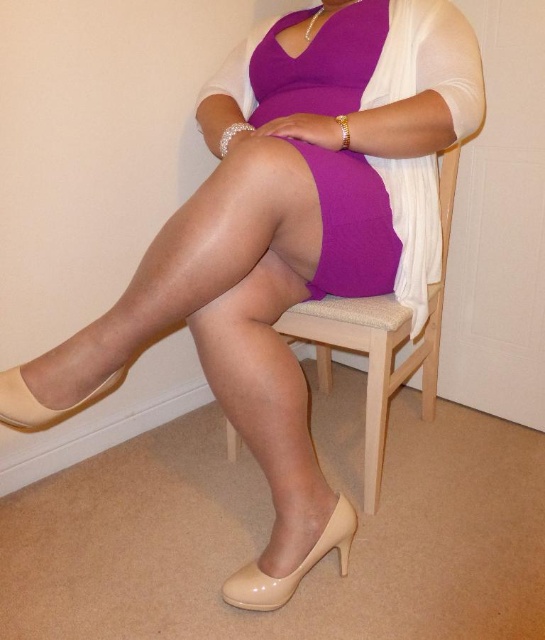
Can you confirm if sheer beige tights at center is positioned to the left of beige wood chair at center?

Yes, sheer beige tights at center is to the left of beige wood chair at center.

Looking at this image, who is higher up, sheer beige tights at center or beige wood chair at center?

sheer beige tights at center is higher up.

Who is more distant from viewer, (288, 196) or (392, 301)?

Point (392, 301)

Find the location of `sheer beige tights at center`. sheer beige tights at center is located at coordinates (178, 275).

Can you confirm if sheer beige tights at center is shorter than matte beige pantyhose at center?

Yes.

Does sheer beige tights at center appear on the left side of matte beige pantyhose at center?

Indeed, sheer beige tights at center is positioned on the left side of matte beige pantyhose at center.

Image resolution: width=545 pixels, height=640 pixels. I want to click on sheer beige tights at center, so click(x=178, y=275).

From the picture: Can you confirm if matte beige pantyhose at center is positioned to the left of purple matte dress at center?

Indeed, matte beige pantyhose at center is positioned on the left side of purple matte dress at center.

At what (x,y) coordinates should I click in order to perform the action: click on matte beige pantyhose at center. Please return your answer as a coordinate pair (x, y). Looking at the image, I should click on (271, 429).